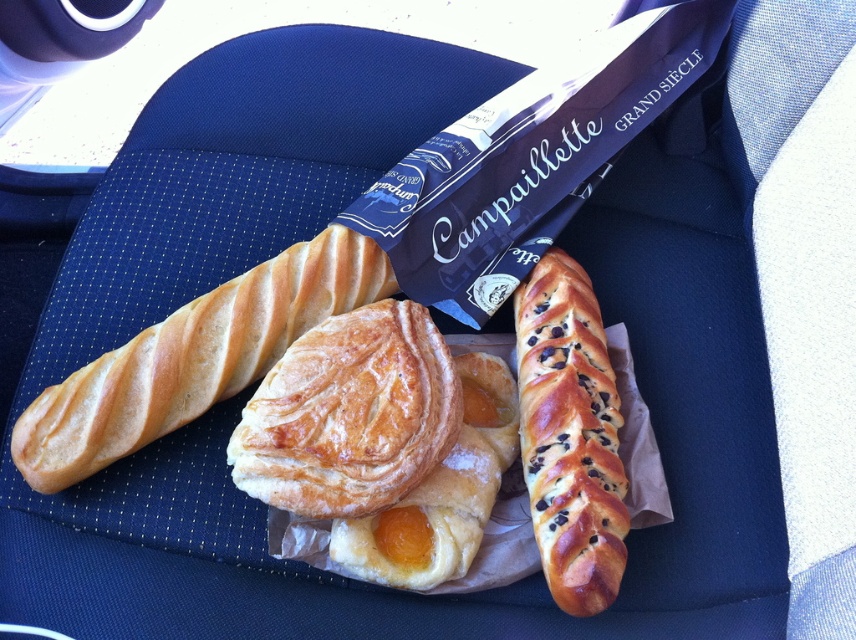
You are a passenger in a car and see the golden brown flaky pastry at center on the seat. If you want to grab it, will you need to stretch your hand forward more than 1 meter?

The golden brown flaky pastry at center is 1.21 meters from camera, so yes, you will need to stretch your hand forward more than 1 meter to reach it.